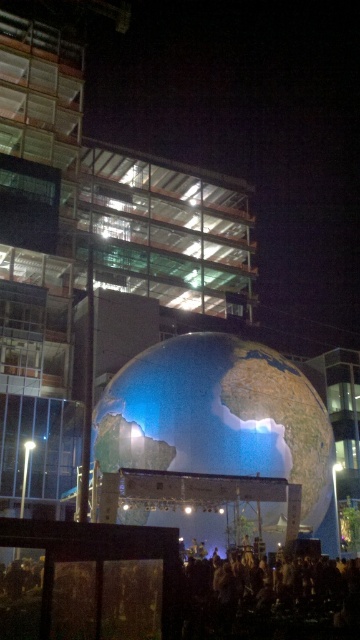
Between shiny metallic globe at center and dark textured crowd at lower center, which one appears on the right side from the viewer's perspective?

dark textured crowd at lower center

Can you confirm if shiny metallic globe at center is bigger than dark textured crowd at lower center?

Indeed, shiny metallic globe at center has a larger size compared to dark textured crowd at lower center.

Is point (155, 465) positioned in front of point (357, 616)?

That is False.

Image resolution: width=360 pixels, height=640 pixels. Find the location of `shiny metallic globe at center`. shiny metallic globe at center is located at coordinates (218, 417).